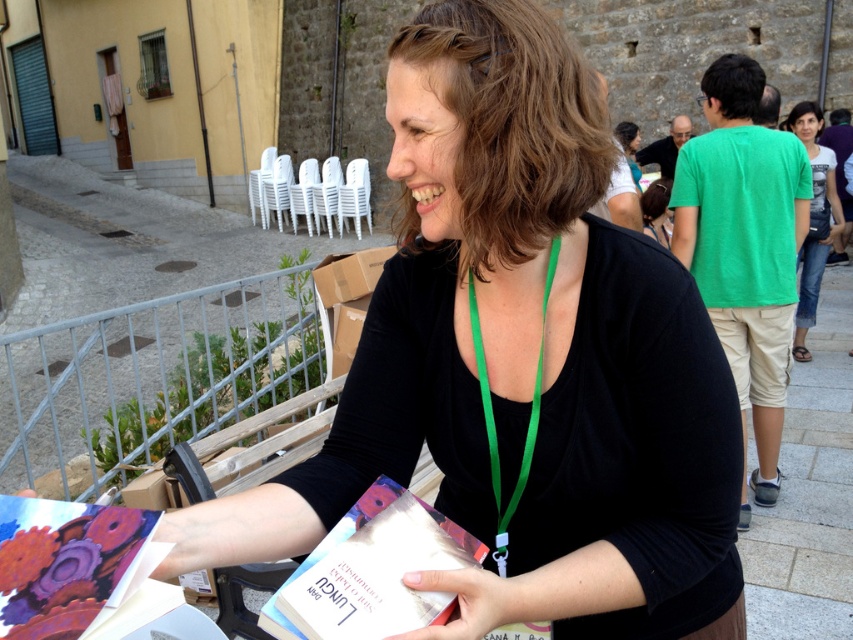
Question: Can you confirm if hardcover book at center is thinner than denim jeans at right?

Choices:
 (A) no
 (B) yes

Answer: (B)

Question: Which point is farther to the camera?

Choices:
 (A) denim jeans at right
 (B) black matte shirt at center

Answer: (A)

Question: Estimate the real-world distances between objects in this image. Which object is closer to the metallic gear design book at lower left?

Choices:
 (A) hardcover book at center
 (B) black matte shirt at center

Answer: (A)

Question: Is metallic gear design book at lower left bigger than denim jeans at right?

Choices:
 (A) yes
 (B) no

Answer: (B)

Question: Does black matte shirt at center appear over hardcover book at center?

Choices:
 (A) yes
 (B) no

Answer: (A)

Question: Which point is closer to the camera?

Choices:
 (A) (122, 573)
 (B) (367, 596)

Answer: (A)